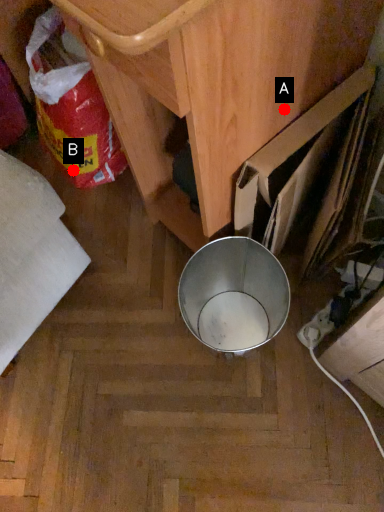
Question: Two points are circled on the image, labeled by A and B beside each circle. Which point is closer to the camera?

Choices:
 (A) A is closer
 (B) B is closer

Answer: (A)